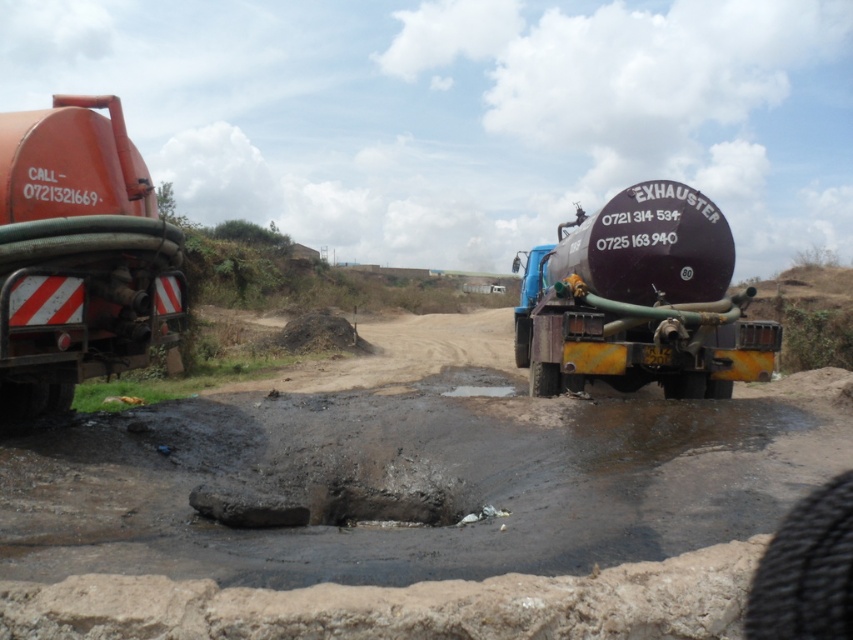
You are a delivery driver who needs to park your truck between the matte orange tank at left and the matte black tank at center. The height of your truck is 2.5 meters. Can you safely park there without hitting the tanks?

The matte orange tank at left has a lesser height compared to matte black tank at center. Since the height of your truck is 2.5 meters, you need to know the exact height of both tanks to determine if it can pass safely. However, the information provided does not specify the actual heights, only that the matte orange tank is shorter than the matte black one. Without knowing the minimum height required, it is not possible to confirm safety.

From the picture: You are a delivery driver who needs to park your truck between the matte orange tank at left and the matte black tank at center. Is there enough space between them to park your truck?

The matte orange tank at left is to the left of matte black tank at center, so there is space between them to park your truck.